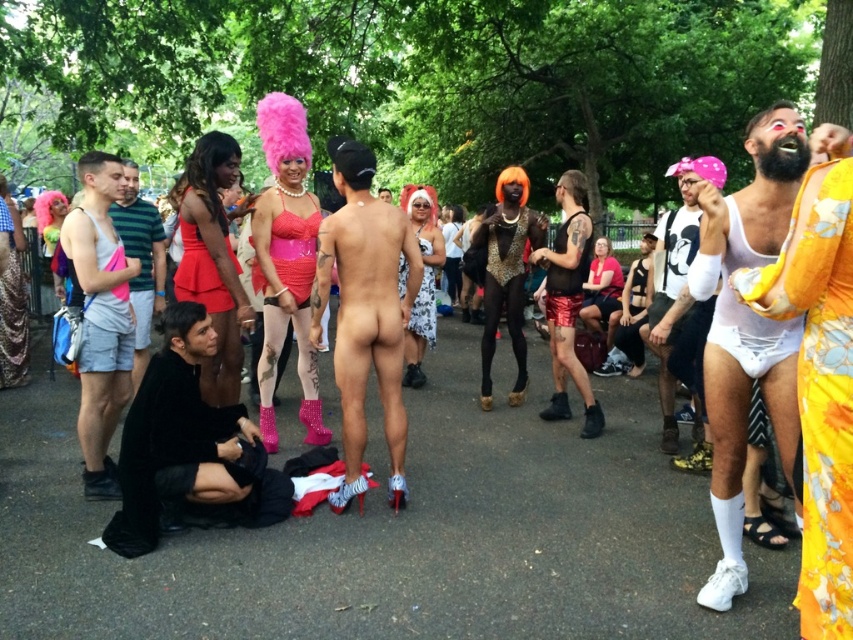
Question: Which object is farther from the camera taking this photo?

Choices:
 (A) white cotton tank top at left
 (B) shiny red dress at center

Answer: (B)

Question: Which point is closer to the camera?

Choices:
 (A) (108, 262)
 (B) (302, 269)

Answer: (A)

Question: Does white matte underwear at right appear on the left side of black sequined vest at center?

Choices:
 (A) no
 (B) yes

Answer: (A)

Question: Can you confirm if smooth skin torso at center is positioned below black matte shorts at left?

Choices:
 (A) no
 (B) yes

Answer: (B)

Question: Which of the following is the closest to the observer?

Choices:
 (A) (363, 490)
 (B) (125, 230)
 (C) (201, 236)
 (D) (206, 524)

Answer: (D)

Question: Does floral silk dress at right have a smaller size compared to black matte jacket at lower left?

Choices:
 (A) no
 (B) yes

Answer: (B)